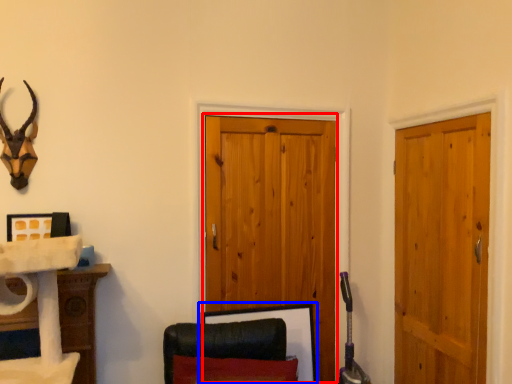
Question: Which object appears closest to the camera in this image, barn door (highlighted by a red box) or picture frame (highlighted by a blue box)?

Choices:
 (A) barn door
 (B) picture frame

Answer: (B)